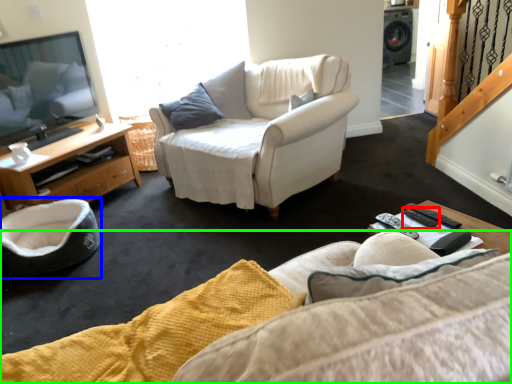
Question: Which object is the farthest from remote (highlighted by a red box)? Choose among these: swivel chair (highlighted by a blue box) or studio couch (highlighted by a green box).

Choices:
 (A) swivel chair
 (B) studio couch

Answer: (A)